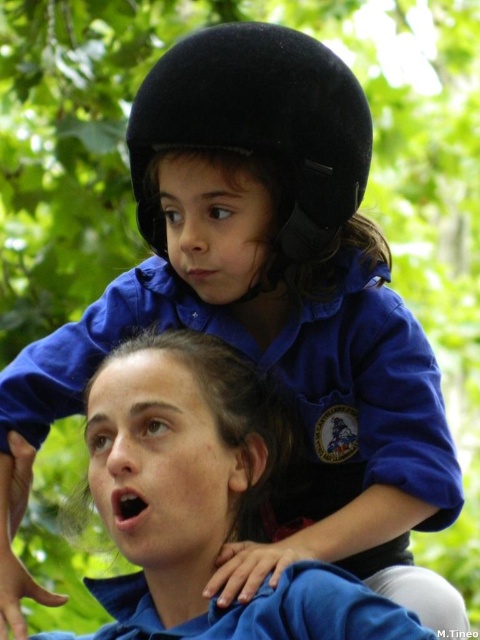
Is point (118, 609) positioned before point (236, 81)?

No.

Measure the distance between point (92,486) and camera.

Point (92,486) and camera are 5.22 feet apart.

The height and width of the screenshot is (640, 480). I want to click on blue fabric shirt at upper center, so click(199, 496).